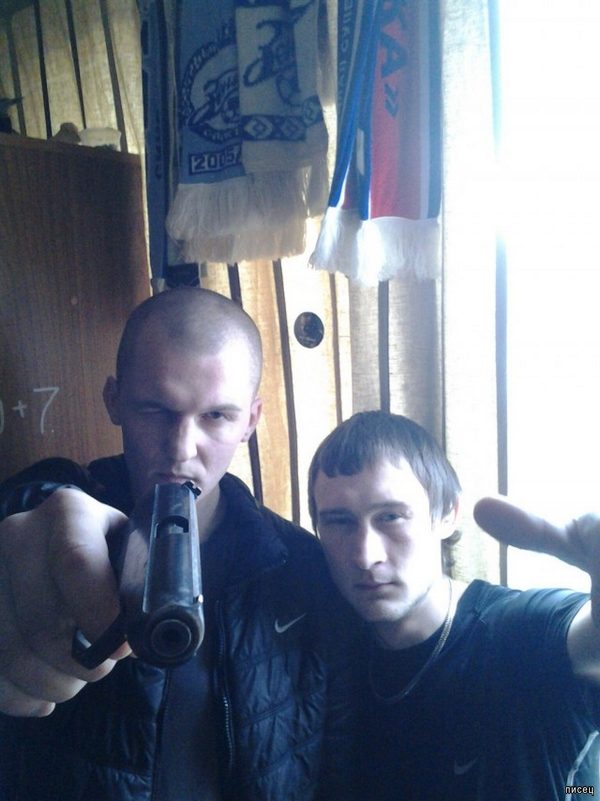
Image resolution: width=600 pixels, height=801 pixels. What are the coordinates of `bright white light` in the screenshot? It's located at (545, 46), (557, 178), (558, 329), (568, 467).